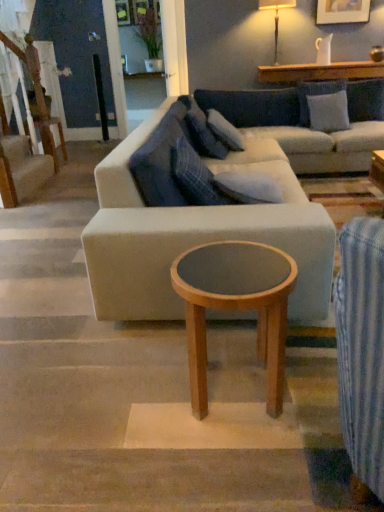
Describe the element at coordinates (236, 306) in the screenshot. I see `light brown wood coffee table at center` at that location.

What do you see at coordinates (217, 214) in the screenshot? I see `light gray fabric couch at center` at bounding box center [217, 214].

Image resolution: width=384 pixels, height=512 pixels. What do you see at coordinates (249, 187) in the screenshot? I see `gray fabric pillow at center, which ranks as the third pillow in front-to-back order` at bounding box center [249, 187].

Locate an element on the screen. This screenshot has width=384, height=512. gray fabric pillow at center, arranged as the 2th pillow when viewed from the back is located at coordinates (249, 187).

Locate an element on the screen. The image size is (384, 512). wooden staircase at left is located at coordinates (21, 169).

This screenshot has width=384, height=512. Identify the location of light brown wood coffee table at center. (236, 306).

Considering the sizes of objects light gray fabric couch at center and gray fabric pillow at center, arranged as the 2th pillow when viewed from the back, in the image provided, who is thinner, light gray fabric couch at center or gray fabric pillow at center, arranged as the 2th pillow when viewed from the back,?

Thinner between the two is gray fabric pillow at center, arranged as the 2th pillow when viewed from the back.

Does point (211, 317) come behind point (250, 183)?

That is False.

Is light gray fabric couch at center positioned far away from gray fabric pillow at center, which ranks as the third pillow in front-to-back order?

That's not correct — light gray fabric couch at center is a little close to gray fabric pillow at center, which ranks as the third pillow in front-to-back order.

From a real-world perspective, is light gray fabric couch at center positioned over gray fabric pillow at center, which ranks as the third pillow in front-to-back order, based on gravity?

Actually, light gray fabric couch at center is physically below gray fabric pillow at center, which ranks as the third pillow in front-to-back order, in the real world.

Would you say wooden round table at left is outside light gray fabric couch at center?

wooden round table at left is positioned outside light gray fabric couch at center.

From a real-world perspective, is wooden round table at left positioned above or below light gray fabric couch at center?

From a real-world perspective, wooden round table at left is physically below light gray fabric couch at center.

In terms of height, does wooden round table at left look taller or shorter compared to light gray fabric couch at center?

In the image, wooden round table at left appears to be shorter than light gray fabric couch at center.

Considering the positions of points (202, 202) and (274, 63), is point (202, 202) closer to camera compared to point (274, 63)?

Yes, it is in front of point (274, 63).

Between blue plaid pillow at center, which is counted as the 3th pillow, starting from the right, and white fabric lampshade at upper right, which one appears on the right side from the viewer's perspective?

Positioned to the right is white fabric lampshade at upper right.

Could white fabric lampshade at upper right be considered to be inside blue plaid pillow at center, which appears as the third pillow when viewed from the back?

No, white fabric lampshade at upper right is not inside blue plaid pillow at center, which appears as the third pillow when viewed from the back.

Is blue plaid pillow at center, positioned as the second pillow in front-to-back order, oriented away from white fabric lampshade at upper right?

No, white fabric lampshade at upper right is not at the back of blue plaid pillow at center, positioned as the second pillow in front-to-back order.

Are blue plaid pillow at center, the first pillow from the front, and wooden staircase at left beside each other?

blue plaid pillow at center, the first pillow from the front, is not next to wooden staircase at left, and they're not touching.

From a real-world perspective, which object stands above the other?

From a 3D spatial view, blue plaid pillow at center, which is the 1th pillow in left-to-right order, is above.

Considering the relative sizes of blue plaid pillow at center, the first pillow from the front, and wooden staircase at left in the image provided, is blue plaid pillow at center, the first pillow from the front, wider than wooden staircase at left?

Indeed, blue plaid pillow at center, the first pillow from the front, has a greater width compared to wooden staircase at left.

Based on their sizes in the image, would you say blue plaid pillow at center, the fourth pillow from the right, is bigger or smaller than wooden staircase at left?

In the image, blue plaid pillow at center, the fourth pillow from the right, appears to be larger than wooden staircase at left.

Looking at this image, which point is more forward, [290,103] or [198,170]?

The point [198,170] is closer.

From a real-world perspective, is light gray fabric couch at center physically below blue plaid pillow at center, which is counted as the 3th pillow, starting from the right?

Yes, from a real-world perspective, light gray fabric couch at center is under blue plaid pillow at center, which is counted as the 3th pillow, starting from the right.

How far apart are light gray fabric couch at center and blue plaid pillow at center, which appears as the third pillow when viewed from the back?

The distance of light gray fabric couch at center from blue plaid pillow at center, which appears as the third pillow when viewed from the back, is 10.67 inches.

Consider the image. Is light gray fabric couch at center situated inside blue plaid pillow at center, which appears as the second pillow when viewed from the left, or outside?

light gray fabric couch at center exists outside the volume of blue plaid pillow at center, which appears as the second pillow when viewed from the left.

Is the position of wooden staircase at left more distant than that of white fabric pillow at upper right, the 4th pillow in the front-to-back sequence?

No, wooden staircase at left is in front of white fabric pillow at upper right, the 4th pillow in the front-to-back sequence.

Does wooden staircase at left have a smaller size compared to white fabric pillow at upper right, which appears as the first pillow when viewed from the back?

No.

Is point (27, 139) behind point (340, 95)?

Yes, point (27, 139) is behind point (340, 95).

Where is `stairwell located on the left of white fabric pillow at upper right, the first pillow viewed from the right`? stairwell located on the left of white fabric pillow at upper right, the first pillow viewed from the right is located at coordinates (21, 169).

Considering the sizes of objects wooden round table at left and white fabric pillow at upper right, the 4th pillow in the front-to-back sequence, in the image provided, who is wider, wooden round table at left or white fabric pillow at upper right, the 4th pillow in the front-to-back sequence,?

Wider between the two is wooden round table at left.

How much distance is there between wooden round table at left and white fabric pillow at upper right, which ranks as the 4th pillow in left-to-right order?

A distance of 8.76 feet exists between wooden round table at left and white fabric pillow at upper right, which ranks as the 4th pillow in left-to-right order.

Considering the relative positions of wooden round table at left and white fabric pillow at upper right, which ranks as the 4th pillow in left-to-right order, in the image provided, is wooden round table at left to the left of white fabric pillow at upper right, which ranks as the 4th pillow in left-to-right order, from the viewer's perspective?

Indeed, wooden round table at left is positioned on the left side of white fabric pillow at upper right, which ranks as the 4th pillow in left-to-right order.

From a real-world perspective, count 2nd pillows upward from the wooden round table at left and point to it. Please provide its 2D coordinates.

[(328, 111)]

Find the location of `studio couch in front of the gray fabric pillow at center, which ranks as the third pillow in front-to-back order`. studio couch in front of the gray fabric pillow at center, which ranks as the third pillow in front-to-back order is located at coordinates (217, 214).

Find the location of a particular element. This screenshot has height=512, width=384. studio couch above the wooden round table at left (from a real-world perspective) is located at coordinates (217, 214).

Estimate the real-world distances between objects in this image. Which object is further from blue plaid pillow at center, the first pillow from the front, wooden round table at left or gray fabric pillow at center, which ranks as the third pillow in front-to-back order?

The object further to blue plaid pillow at center, the first pillow from the front, is wooden round table at left.

From the image, which object appears to be farther from wooden staircase at left, wooden round table at left or light gray fabric couch at center?

light gray fabric couch at center.

Which object lies nearer to the anchor point light brown wood coffee table at center, blue plaid pillow at center, which is the 1th pillow in left-to-right order, or white fabric pillow at upper right, the first pillow viewed from the right?

The object closer to light brown wood coffee table at center is blue plaid pillow at center, which is the 1th pillow in left-to-right order.

Which object lies nearer to the anchor point light gray fabric couch at center, white fabric lampshade at upper right or white fabric pillow at upper right, the 4th pillow in the front-to-back sequence?

Among the two, white fabric pillow at upper right, the 4th pillow in the front-to-back sequence, is located nearer to light gray fabric couch at center.

Which object lies nearer to the anchor point gray fabric pillow at center, arranged as the 2th pillow when viewed from the back, white fabric pillow at upper right, which ranks as the 4th pillow in left-to-right order, or wooden round table at left?

The object closer to gray fabric pillow at center, arranged as the 2th pillow when viewed from the back, is white fabric pillow at upper right, which ranks as the 4th pillow in left-to-right order.

Based on their spatial positions, is wooden round table at left or blue plaid pillow at center, the first pillow from the front, further from gray fabric pillow at center, which is the 2th pillow from right to left?

wooden round table at left is further to gray fabric pillow at center, which is the 2th pillow from right to left.

Considering their positions, is white fabric lampshade at upper right positioned further to blue plaid pillow at center, the first pillow from the front, than gray fabric pillow at center, which ranks as the third pillow in front-to-back order?

Among the two, white fabric lampshade at upper right is located further to blue plaid pillow at center, the first pillow from the front.

Based on their spatial positions, is wooden round table at left or blue plaid pillow at center, which appears as the third pillow when viewed from the back, closer to wooden staircase at left?

wooden round table at left lies closer to wooden staircase at left than the other object.

The image size is (384, 512). In order to click on pillow situated between blue plaid pillow at center, the first pillow from the front, and gray fabric pillow at center, the 3th pillow positioned from the left, from left to right in this screenshot , I will do `click(195, 176)`.

You are a GUI agent. You are given a task and a screenshot of the screen. Output one action in this format:
    pyautogui.click(x=<x>, y=<y>)
    Task: Click on the studio couch between light brown wood coffee table at center and white fabric pillow at upper right, which ranks as the 4th pillow in left-to-right order, along the z-axis
    Image resolution: width=384 pixels, height=512 pixels.
    Given the screenshot: What is the action you would take?
    pyautogui.click(x=217, y=214)

Find the location of a particular element. pillow located between light brown wood coffee table at center and blue plaid pillow at center, which is counted as the 3th pillow, starting from the right, in the depth direction is located at coordinates (161, 159).

You are a GUI agent. You are given a task and a screenshot of the screen. Output one action in this format:
    pyautogui.click(x=<x>, y=<y>)
    Task: Click on the stairwell between light brown wood coffee table at center and wooden round table at left along the z-axis
    The height and width of the screenshot is (512, 384).
    Given the screenshot: What is the action you would take?
    pyautogui.click(x=21, y=169)